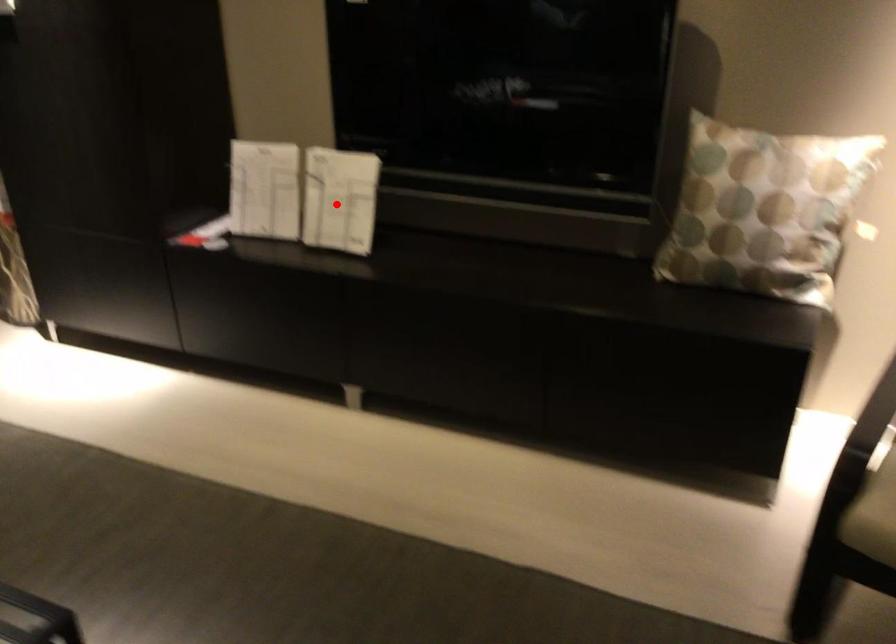
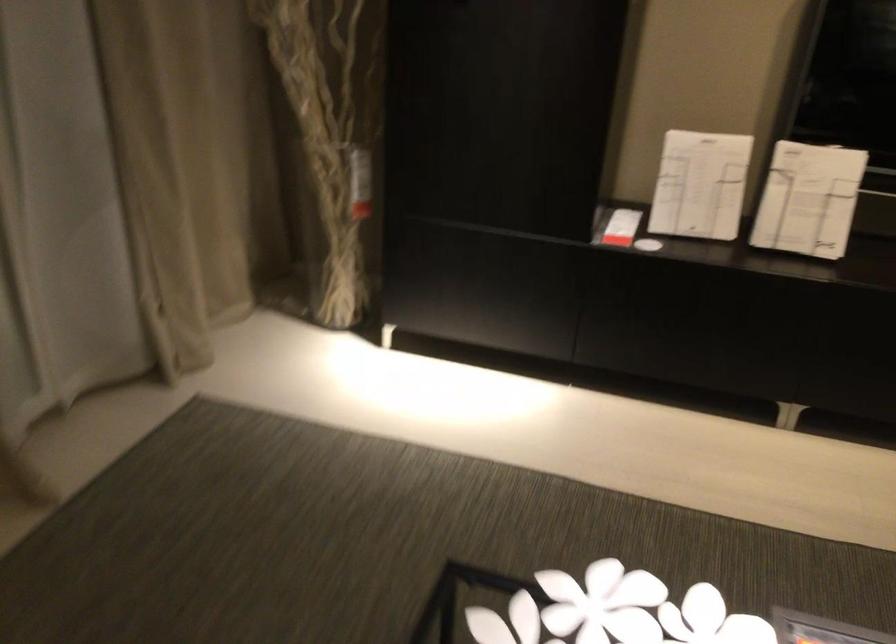
Where in the second image is the point corresponding to the highlighted location from the first image?

(808, 200)